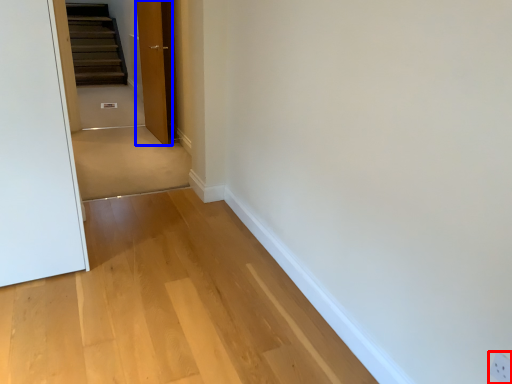
Question: Which object is further to the camera taking this photo, electric outlet (highlighted by a red box) or door (highlighted by a blue box)?

Choices:
 (A) electric outlet
 (B) door

Answer: (B)